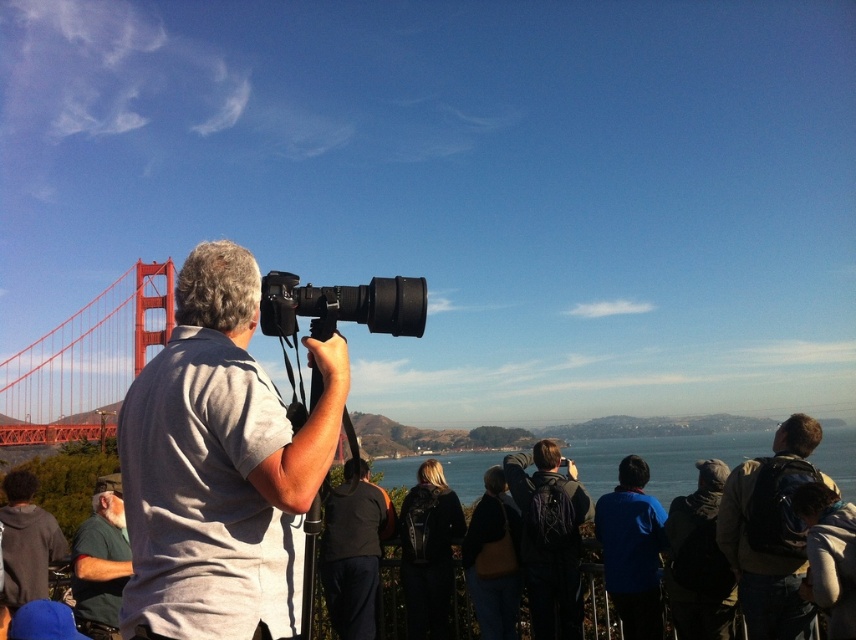
You are standing at the overlook and want to take a photo of the green fabric shirt at lower left without the dark blue backpack at center blocking the view. Is this possible?

The dark blue backpack at center is further to the viewer than green fabric shirt at lower left, so the backpack would block the view of the shirt. Move around to the side to avoid the backpack.